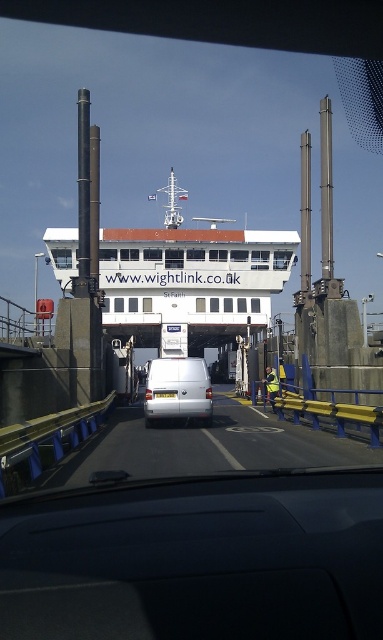
Is white matte ferry at center bigger than white matte van at center?

Yes, white matte ferry at center is bigger than white matte van at center.

Is white matte ferry at center in front of white matte van at center?

No, white matte ferry at center is further to the viewer.

The image size is (383, 640). In order to click on white matte ferry at center in this screenshot , I will do `click(191, 276)`.